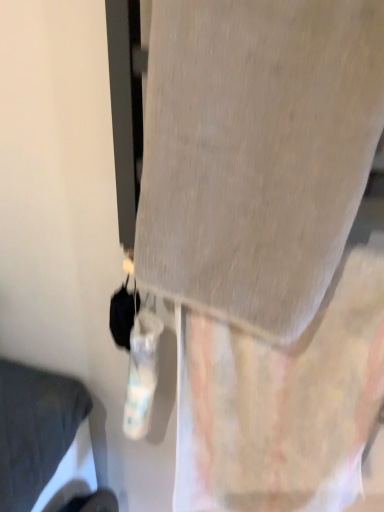
Identify the location of empty space that is ontop of matte gray pillow at lower left (from a real-world perspective). Image resolution: width=384 pixels, height=512 pixels. (33, 413).